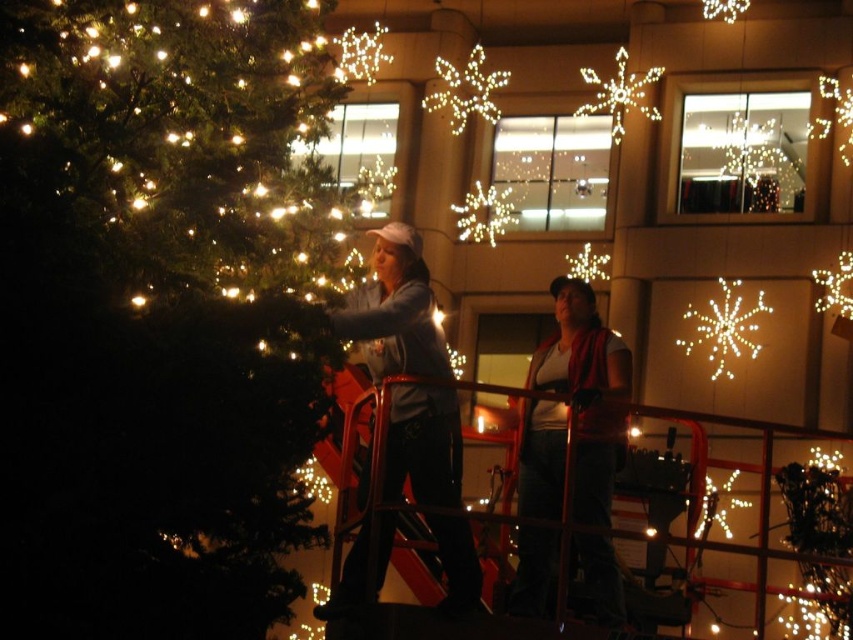
Question: Does matte white tank top at center appear over illuminated plastic snowflake at upper right?

Choices:
 (A) no
 (B) yes

Answer: (A)

Question: Where is illuminated matte green tree at left located in relation to matte white tank top at center in the image?

Choices:
 (A) above
 (B) below

Answer: (A)

Question: Which object is closer to the camera taking this photo?

Choices:
 (A) matte gray sweater at center
 (B) matte white tank top at center

Answer: (A)

Question: Is matte white tank top at center smaller than illuminated plastic snowflake at upper center?

Choices:
 (A) yes
 (B) no

Answer: (B)

Question: Which object is the farthest from the illuminated matte green tree at left?

Choices:
 (A) matte gray sweater at center
 (B) illuminated plastic snowflake at upper center

Answer: (B)

Question: Which object is positioned closest to the illuminated plastic snowflake at upper center?

Choices:
 (A) matte white tank top at center
 (B) illuminated matte green tree at left

Answer: (A)